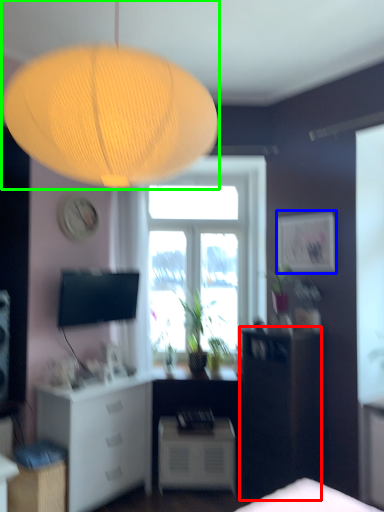
Question: Considering the real-world distances, which object is farthest from furniture (highlighted by a red box)? picture frame (highlighted by a blue box) or lamp (highlighted by a green box)?

Choices:
 (A) picture frame
 (B) lamp

Answer: (B)